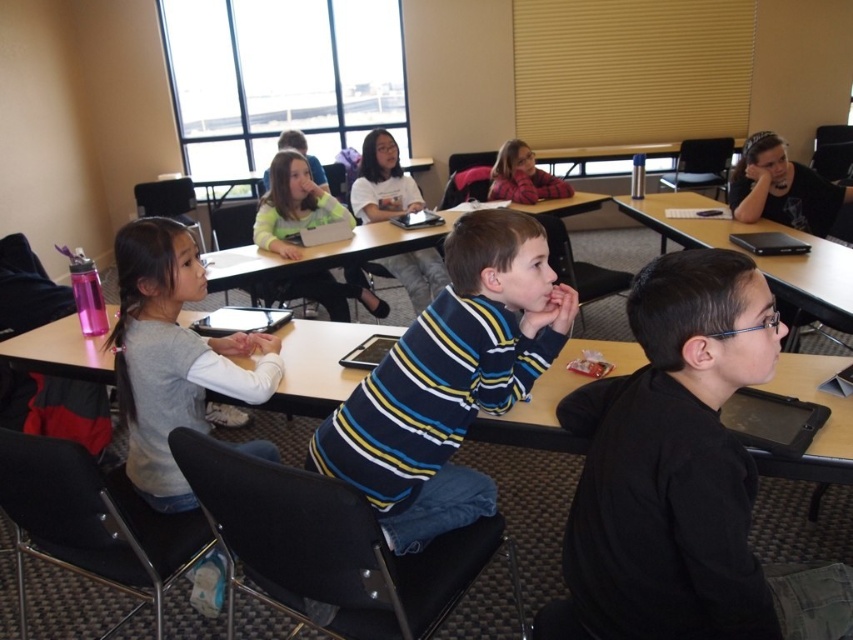
Question: Which object is the farthest from the black matte shirt at lower right?

Choices:
 (A) black plastic tablet at right
 (B) matte plastic table at center
 (C) plaid fabric shirt at upper center

Answer: (C)

Question: Is gray cotton shirt at left further to camera compared to matte green sweater at center?

Choices:
 (A) no
 (B) yes

Answer: (A)

Question: Considering the real-world distances, which object is closest to the matte plastic table at center?

Choices:
 (A) black matte shirt at lower right
 (B) white cotton shirt at center

Answer: (A)

Question: Can you confirm if white cotton shirt at center is positioned to the left of plaid fabric shirt at upper center?

Choices:
 (A) yes
 (B) no

Answer: (A)

Question: Can you confirm if matte plastic table at center is thinner than matte green sweater at center?

Choices:
 (A) no
 (B) yes

Answer: (B)

Question: Estimate the real-world distances between objects in this image. Which object is farther from the gray cotton shirt at left?

Choices:
 (A) striped cotton shirt at center
 (B) matte green sweater at center
 (C) white cotton shirt at center
 (D) plaid fabric shirt at upper center

Answer: (D)